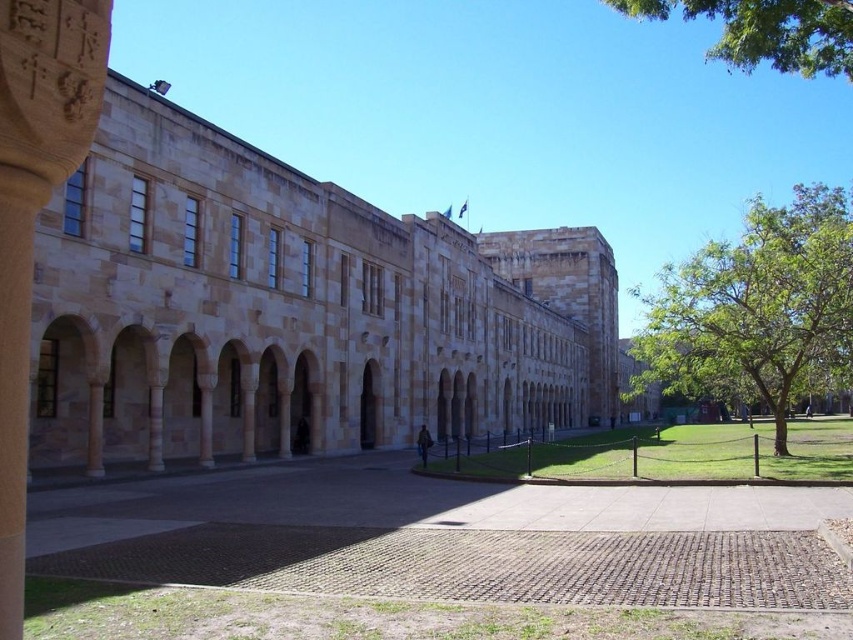
Question: Which object is the closest to the green leafy tree at right?

Choices:
 (A) carved stone pillar at center
 (B) green leafy tree at upper right

Answer: (B)

Question: Among these objects, which one is nearest to the camera?

Choices:
 (A) green leafy tree at right
 (B) carved stone pillar at center

Answer: (B)

Question: Does green leafy tree at right appear on the right side of green leafy tree at upper right?

Choices:
 (A) yes
 (B) no

Answer: (A)

Question: Can you confirm if carved stone pillar at center is positioned below green leafy tree at upper right?

Choices:
 (A) yes
 (B) no

Answer: (A)

Question: Which point is farther from the camera taking this photo?

Choices:
 (A) pyautogui.click(x=744, y=362)
 (B) pyautogui.click(x=753, y=40)
 (C) pyautogui.click(x=22, y=113)

Answer: (A)

Question: Is green leafy tree at right bigger than green leafy tree at upper right?

Choices:
 (A) no
 (B) yes

Answer: (A)